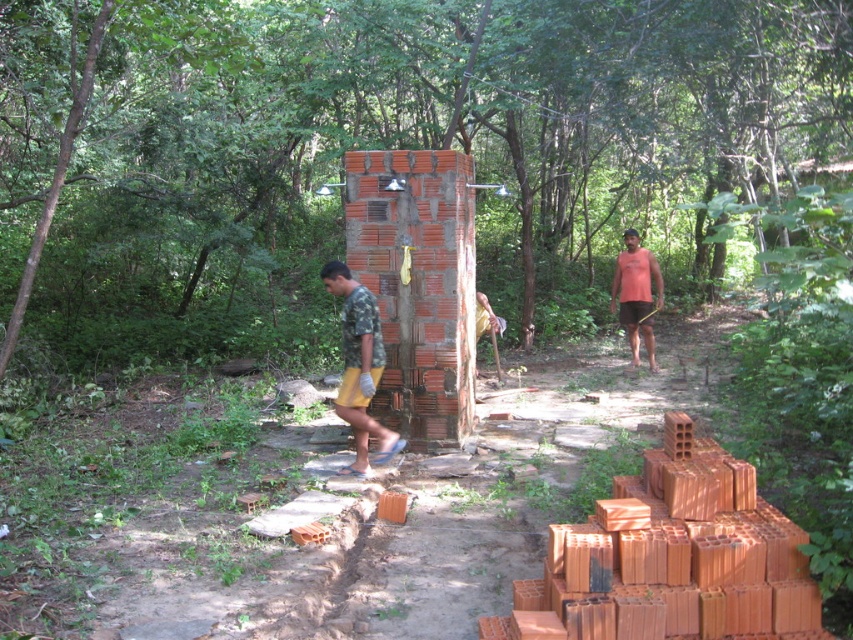
You are a construction worker wearing a camouflage fabric shirt at center. You need to place a new orange brick from the pile on the right side onto the partially constructed red brick wall in the center. Can you reach the point at coordinates point (358, 365) on the camouflage fabric shirt at center to pick up the brick?

The point 0.573, 0422 is on camouflage fabric shirt at center, so yes, you can reach the point (358, 365) on the camouflage fabric shirt at center to pick up the brick.

You are a construction worker in the forest scene. You need to choose between two shirts to wear for the job. The camouflage fabric shirt at center and the orange tank top at right. Based on their sizes, which shirt would be more comfortable for layering under a heavy jacket?

The camouflage fabric shirt at center has a smaller size compared to the orange tank top at right. Therefore, the orange tank top at right would be more comfortable for layering under a heavy jacket because it has a larger size, allowing more room for movement and layers.